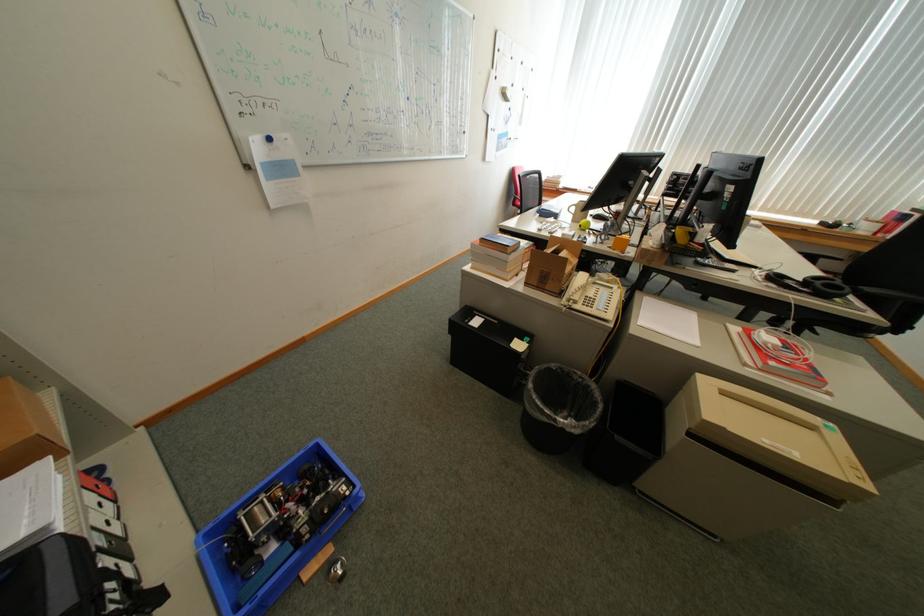
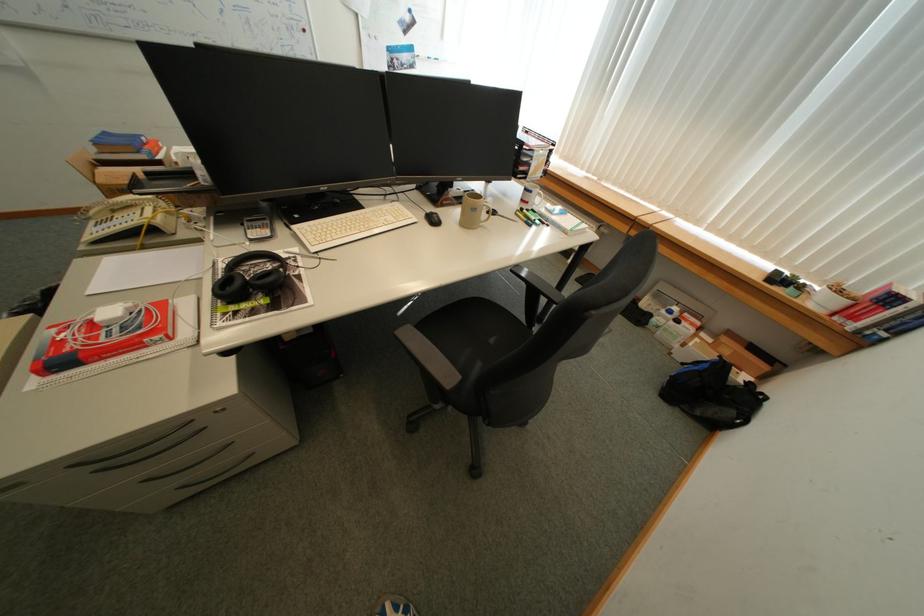
Question: What movement of the cameraman would produce the second image?

Choices:
 (A) Left
 (B) Right
 (C) Forward
 (D) Backward

Answer: (B)